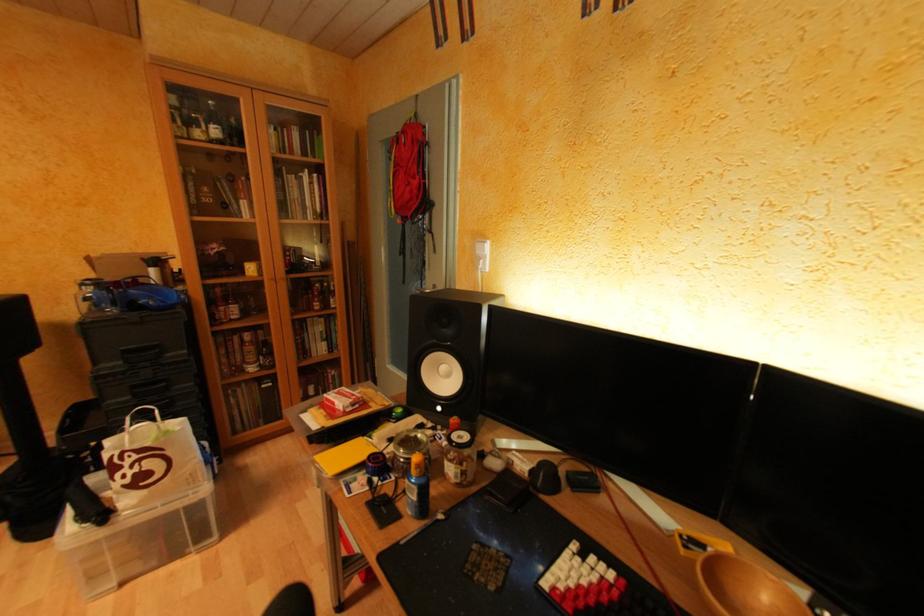
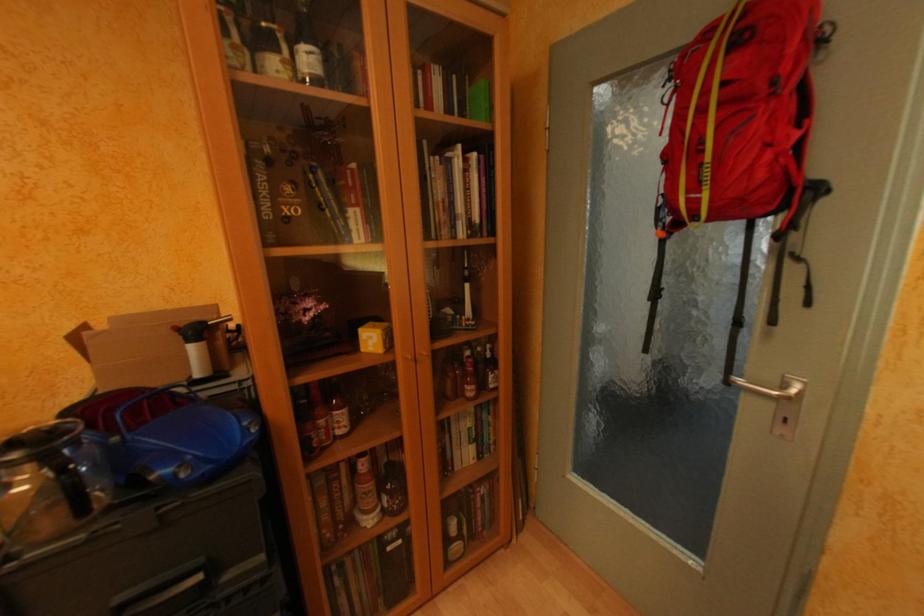
What movement of the cameraman would produce the second image?

The cameraman walked toward left, forward.